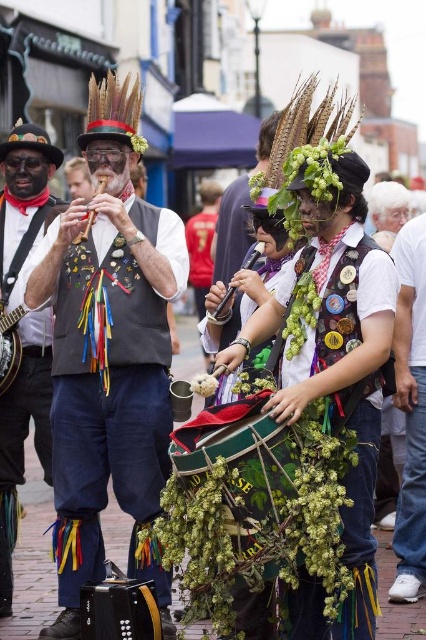
Locate an element on the screen. matte black banjo at left is located at coordinates (x=23, y=433).

Is matte black banjo at left further to the viewer compared to wooden flute at center?

That is False.

The width and height of the screenshot is (426, 640). What do you see at coordinates (23, 433) in the screenshot?
I see `matte black banjo at left` at bounding box center [23, 433].

Find the location of `matte black banjo at left`. matte black banjo at left is located at coordinates (23, 433).

Between matte black vest at center and wooden flute at center, which one appears on the left side from the viewer's perspective?

matte black vest at center

Does matte black vest at center have a lesser width compared to wooden flute at center?

In fact, matte black vest at center might be wider than wooden flute at center.

Between point (80, 458) and point (218, 308), which one is positioned behind?

The point (218, 308) is more distant.

At what (x,y) coordinates should I click in order to perform the action: click on matte black vest at center. Please return your answer as a coordinate pair (x, y). Looking at the image, I should click on (106, 346).

Can you confirm if wooden flute at center is positioned to the right of brushed metal flute at upper left?

Correct, you'll find wooden flute at center to the right of brushed metal flute at upper left.

Between point (215, 314) and point (106, 180), which one is positioned behind?

The point (106, 180) is behind.

What do you see at coordinates (255, 253) in the screenshot?
I see `wooden flute at center` at bounding box center [255, 253].

Where is `wooden flute at center`? This screenshot has width=426, height=640. wooden flute at center is located at coordinates pyautogui.click(x=255, y=253).